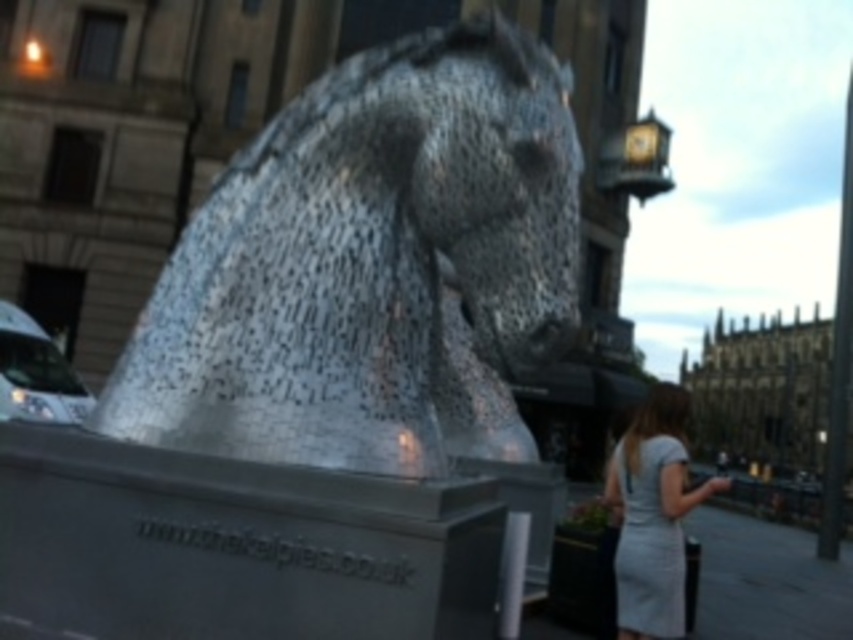
Where is `shiny metallic horse at center`? Image resolution: width=853 pixels, height=640 pixels. shiny metallic horse at center is located at coordinates click(x=370, y=268).

This screenshot has width=853, height=640. Identify the location of shiny metallic horse at center. (370, 268).